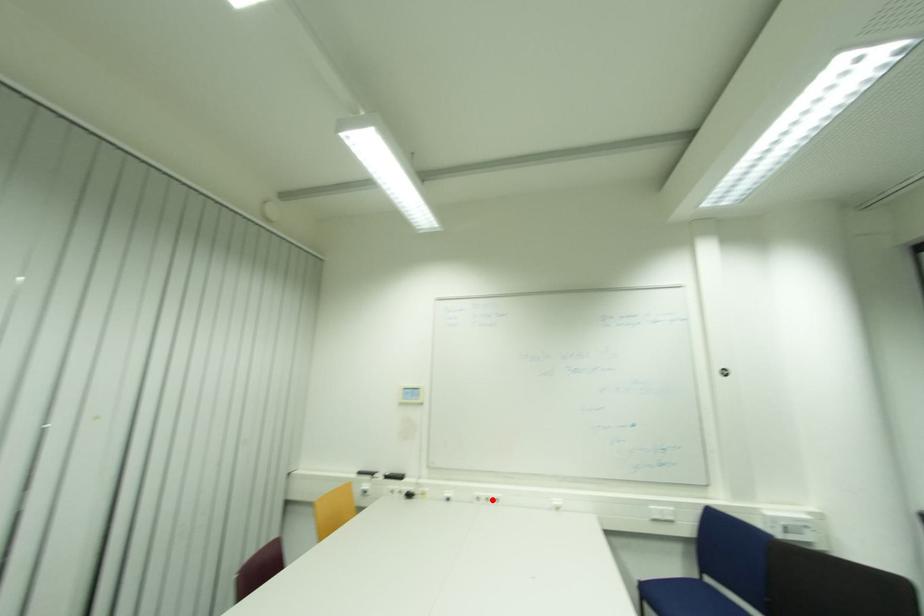
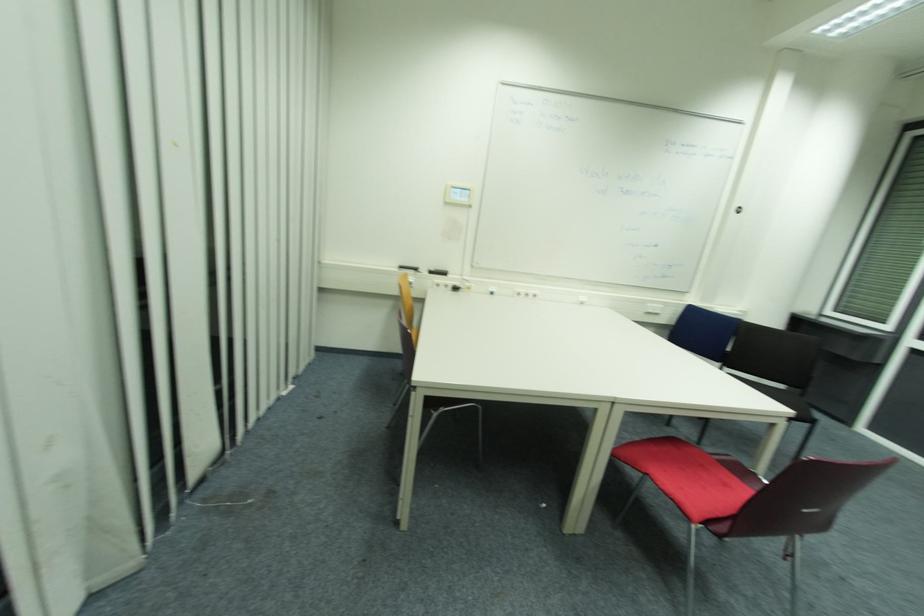
Question: I am providing you with two images of the same scene from different viewpoints. Given a red point in image1, look at the same physical point in image2. Is it:

Choices:
 (A) Closer to the viewpoint
 (B) Farther from the viewpoint

Answer: (A)